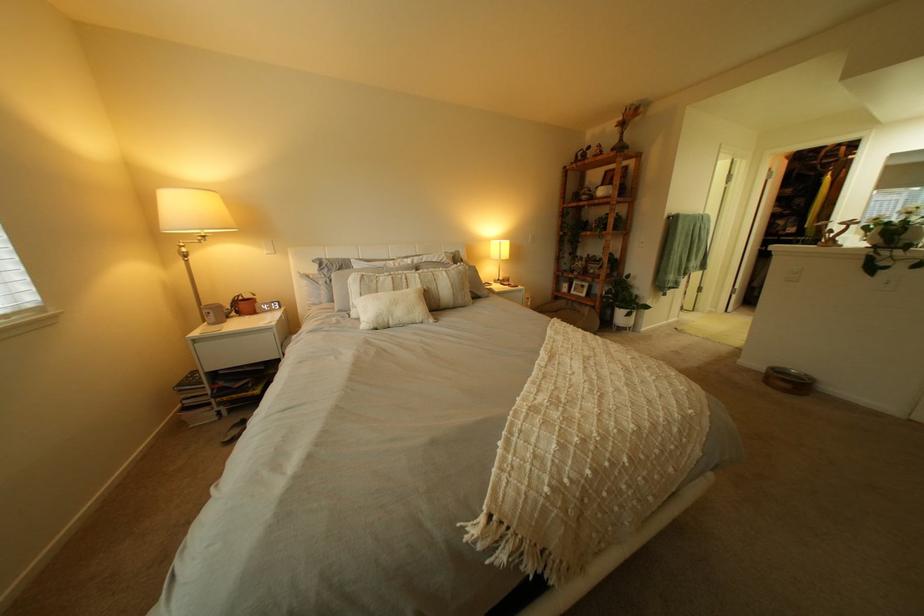
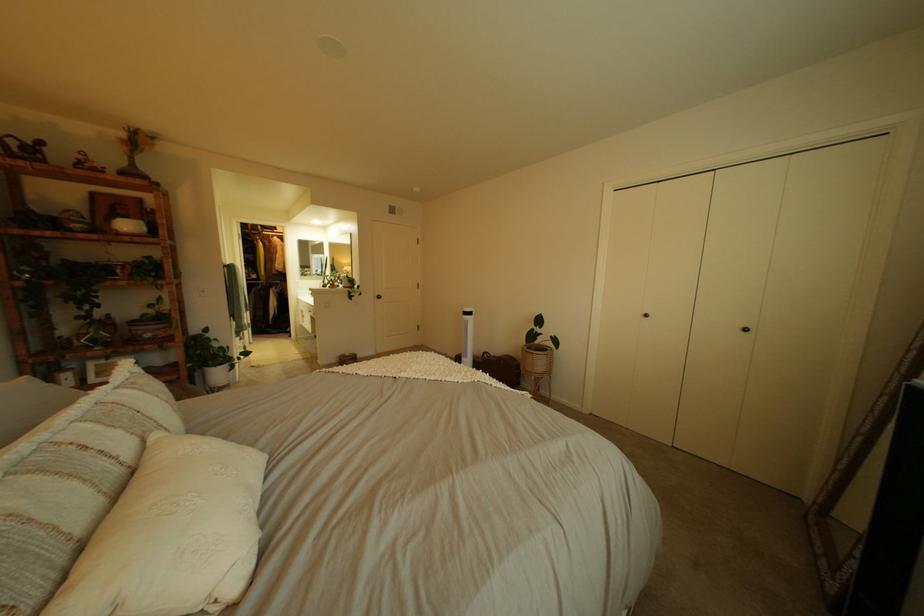
In the second image, find the point that corresponds to [435,288] in the first image.

(172, 436)